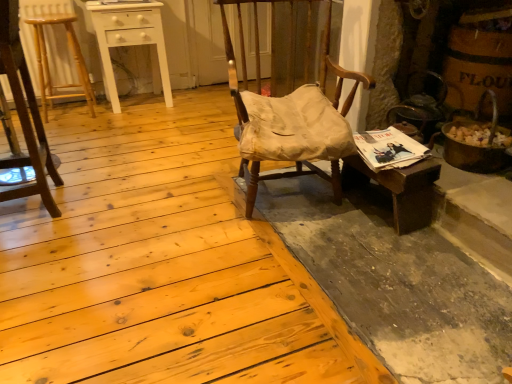
This screenshot has width=512, height=384. Find the location of `blank area beneath wooden chair with worn fabric cushion at center, the first chair in the right-to-left sequence (from a real-world perspective)`. blank area beneath wooden chair with worn fabric cushion at center, the first chair in the right-to-left sequence (from a real-world perspective) is located at coordinates (287, 196).